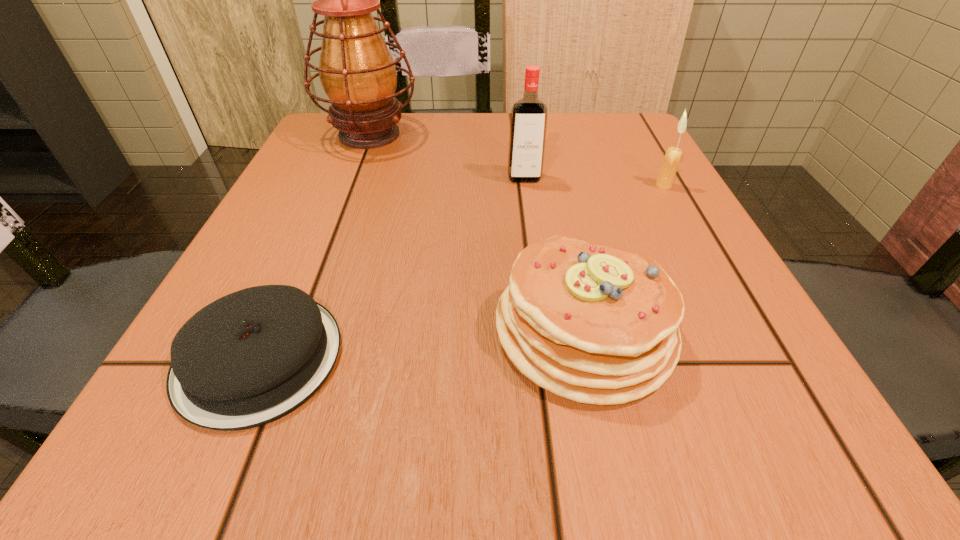
Find the location of a particular element. This screenshot has height=540, width=960. oil lamp is located at coordinates (357, 72).

The height and width of the screenshot is (540, 960). I want to click on the tallest object, so click(x=357, y=72).

Where is `the fourth shortest object`? The width and height of the screenshot is (960, 540). the fourth shortest object is located at coordinates (528, 123).

Find the location of a particular element. This screenshot has width=960, height=540. the third tallest object is located at coordinates (673, 155).

Locate an element on the screen. The height and width of the screenshot is (540, 960). candle is located at coordinates click(x=673, y=155).

The width and height of the screenshot is (960, 540). I want to click on the right pancake, so click(595, 324).

This screenshot has height=540, width=960. I want to click on the second shortest object, so click(595, 324).

Find the location of a particular element. This screenshot has width=960, height=540. the left pancake is located at coordinates (251, 357).

Identify the location of the shortest object. The image size is (960, 540). (251, 357).

You are a GUI agent. You are given a task and a screenshot of the screen. Output one action in this format:
    pyautogui.click(x=<x>, y=<y>)
    Task: Click on the blank area located 0.290m on the front of the farthest object
    
    Given the screenshot: What is the action you would take?
    pyautogui.click(x=324, y=254)